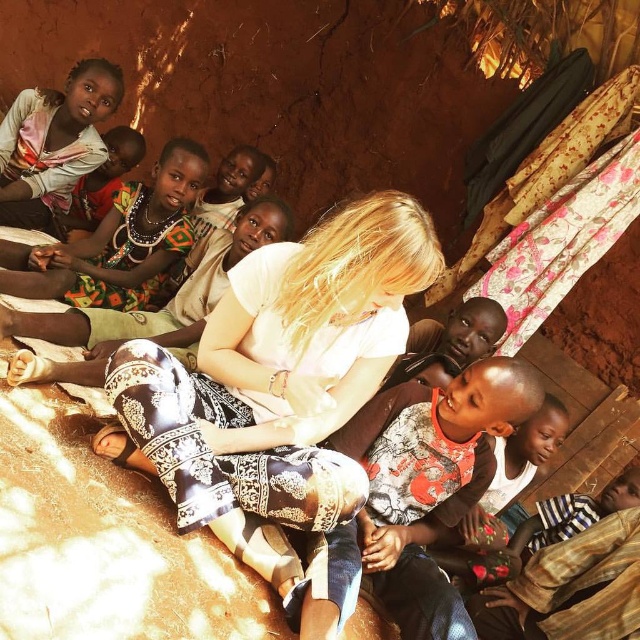
You are a photographer standing in the scene and want to take a photo of the white printed pants at center and the printed fabric dress at upper left. Which one is closer to you?

The white printed pants at center is in front of the printed fabric dress at upper left, so it is closer to you.

You are a photographer standing in front of the scene. You want to take a photo of the printed fabric dress at upper left and the matte pink scarf at upper left. Which object is positioned to the right side of the other?

The printed fabric dress at upper left is to the right of the matte pink scarf at upper left.

You are standing at the entrance of the rustic indoor setting and want to place a new decorative item on the white printed pants at center located at point (x=276, y=381). Can you confirm if this location is suitable based on the scene description?

The white printed pants at center are located at point (x=276, y=381). Since the scene description mentions that the children are seated closely together on the floor near the center, placing an item there might disturb their space. Choose a different location.